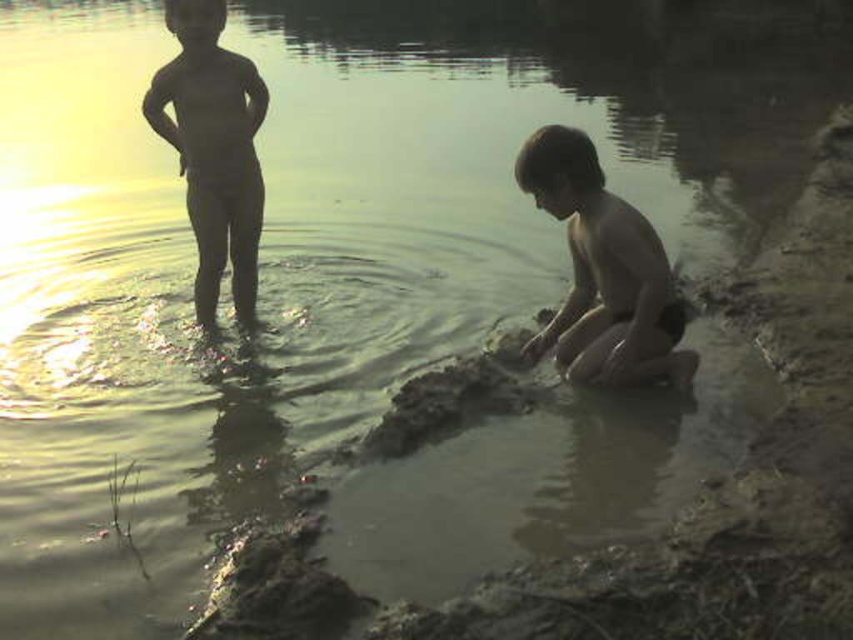
You are standing at the point marked as point (581, 163). You want to throw a ball to a friend who is standing 5 meters away from you. Can you reach your friend with the throw?

The distance between you and your friend is 4.46 meters, which is less than 5 meters, so yes, you can reach your friend with the throw.

You are a photographer trying to capture both the smooth skin boy at lower right and the smooth skin child at left in a single frame. Based on their positions, which child might require more space in the composition to avoid being cropped?

The smooth skin boy at lower right might require more space in the composition since he is wider than the smooth skin child at left.

You are a photographer trying to capture the scene of the two children playing by the water. You want to ensure that the smooth skin boy at lower right is centered in your shot. Given the coordinates provided in the description, where should you position your camera to achieve this?

The smooth skin boy at lower right is located at point (602,272). To center him in the shot, adjust the camera so that the center of the frame aligns with these coordinates.